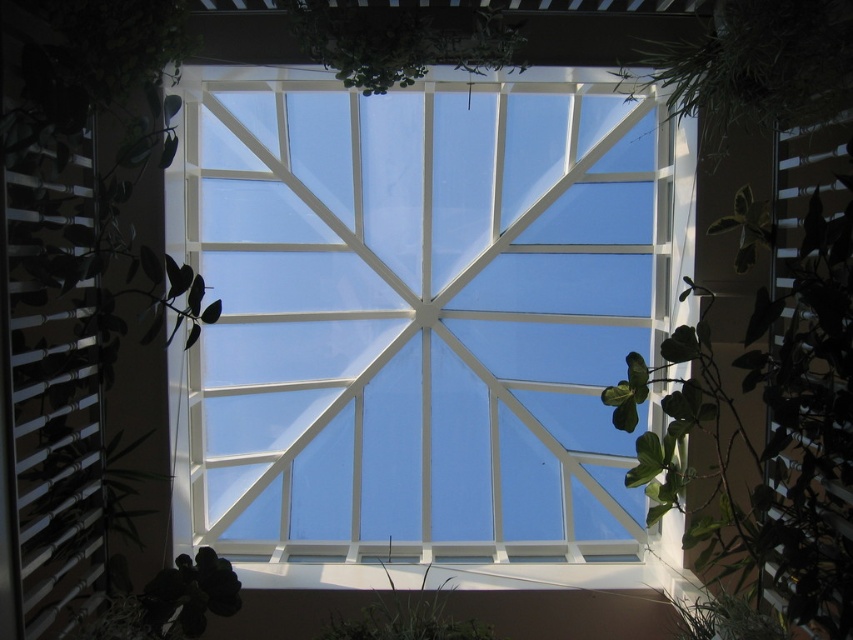
You are a gardener planning to prune both the green leafy plant at upper right and the green leafy plant at center. Which plant requires more careful handling due to its size?

The green leafy plant at center requires more careful handling because it has a greater width than the green leafy plant at upper right.

You are standing in the atrium looking up at the skylight. You notice the transparent glass window at center and the green leafy plant at center. Which object is taller?

The transparent glass window at center is taller than the green leafy plant at center.